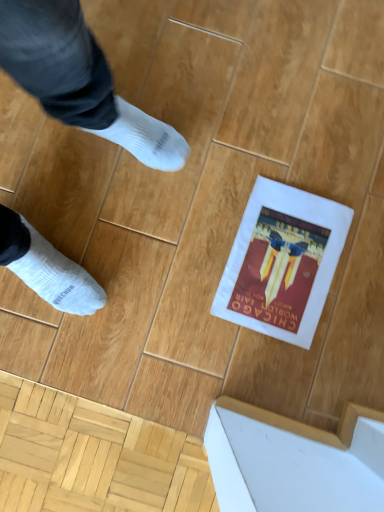
Image resolution: width=384 pixels, height=512 pixels. Describe the element at coordinates (282, 262) in the screenshot. I see `white matte book cover at center` at that location.

Locate an element on the screen. The height and width of the screenshot is (512, 384). white matte book cover at center is located at coordinates (282, 262).

Where is `white matte book cover at center`? This screenshot has width=384, height=512. white matte book cover at center is located at coordinates (282, 262).